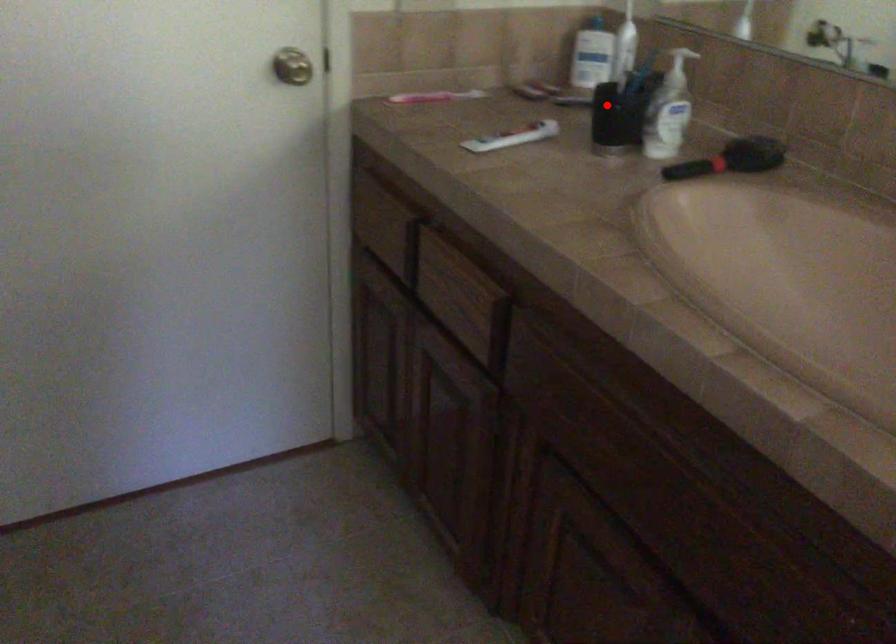
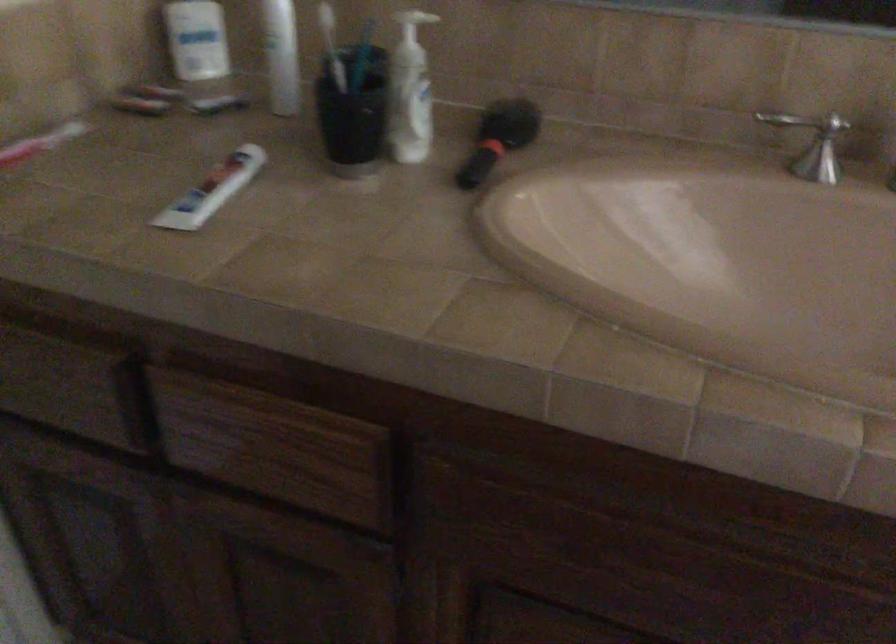
Find the pixel in the second image that matches the highlighted location in the first image.

(352, 113)